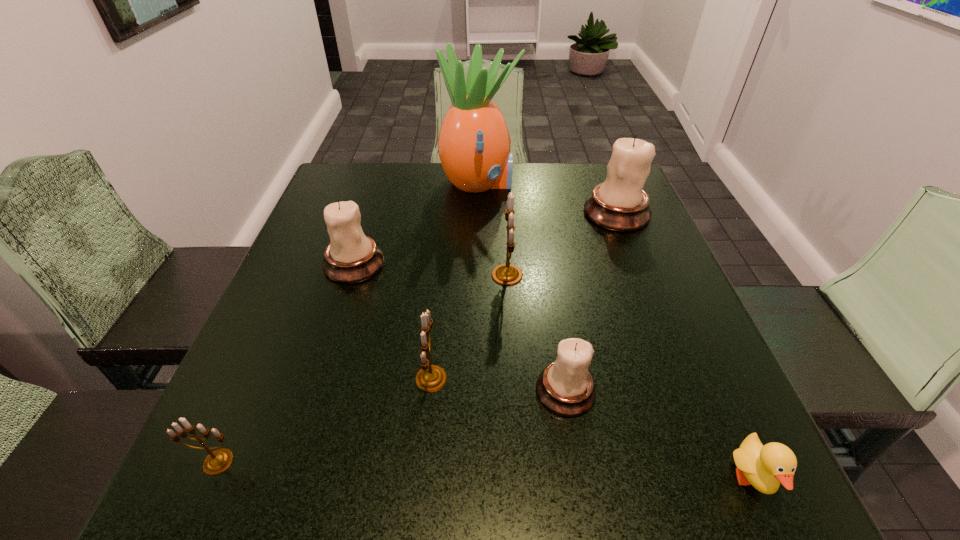
Where is `free space in the image that satisfies the following two spatial constraints: 1. on the front side of the second white candle holder from left to right; 2. on the left side of the second farthest white candle holder`? free space in the image that satisfies the following two spatial constraints: 1. on the front side of the second white candle holder from left to right; 2. on the left side of the second farthest white candle holder is located at coordinates (314, 391).